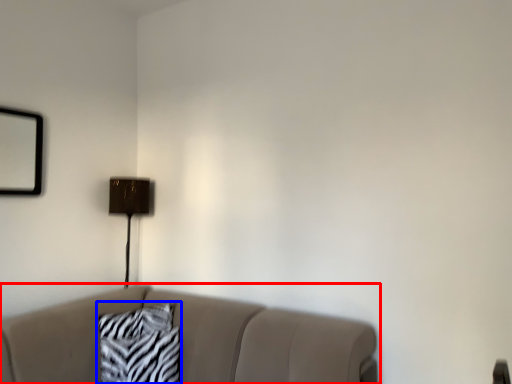
Question: Among these objects, which one is farthest to the camera, studio couch (highlighted by a red box) or pillow (highlighted by a blue box)?

Choices:
 (A) studio couch
 (B) pillow

Answer: (B)